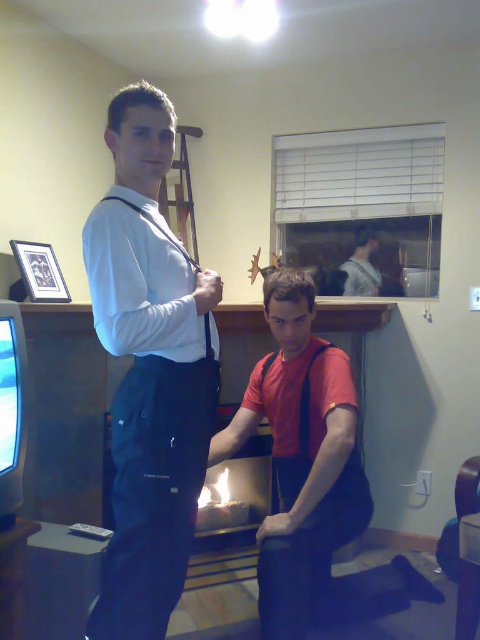
Question: Which object is positioned farthest from the matte black suspenders at upper left?

Choices:
 (A) smooth gray shirt at center
 (B) white matte shirt at center

Answer: (A)

Question: Does smooth gray shirt at center lie behind matte black suspenders at upper left?

Choices:
 (A) yes
 (B) no

Answer: (A)

Question: Which point is farther to the camera?

Choices:
 (A) white matte shirt at center
 (B) smooth gray shirt at center
 (C) matte black suspenders at upper left

Answer: (B)

Question: Which point is farther to the camera?

Choices:
 (A) (206, 355)
 (B) (144, 147)

Answer: (A)

Question: Does white matte shirt at center have a smaller size compared to matte black suspenders at upper left?

Choices:
 (A) no
 (B) yes

Answer: (A)

Question: Is white matte shirt at center smaller than smooth gray shirt at center?

Choices:
 (A) yes
 (B) no

Answer: (B)